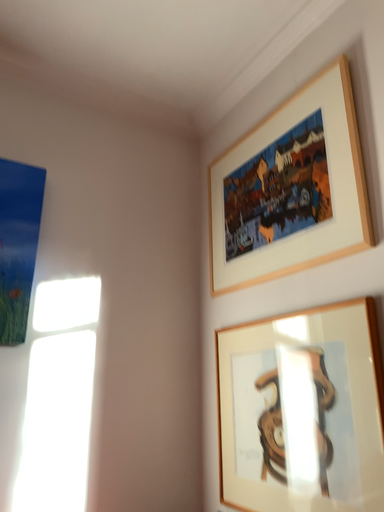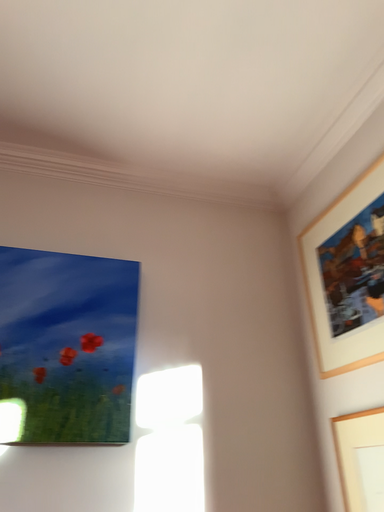
Question: Which way did the camera rotate in the video?

Choices:
 (A) rotated downward
 (B) rotated upward

Answer: (B)